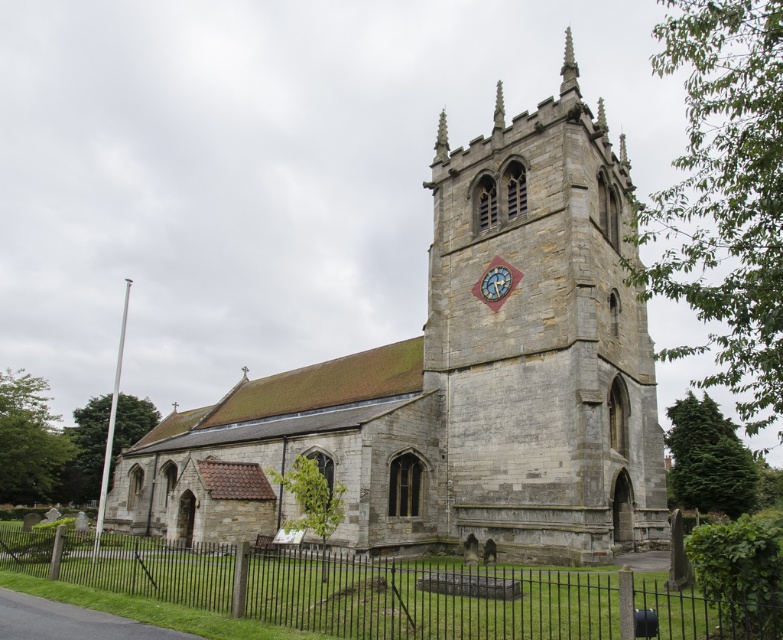
You are standing in front of a traditional stone church with a clock tower. You notice two structures at the upper center of the church building. One is labeled as the stone spire at upper center and the other as the stone steeple at upper center. According to their positions, which one is located to the right?

The stone spire at upper center is located to the right of the stone steeple at upper center.

You are standing at the entrance of the traditional stone church and looking towards the clock tower. There is a stone spire located at point (568, 67). Can you tell me the direction of the stone spire relative to your position?

The stone spire at upper center is located at point (568, 67), which is in the upper center direction from your position at the entrance.

You are a drone operator tasked with capturing aerial footage of the church. Your drone has a maximum flight range of 50 meters from its starting position. If you position yourself at the black wrought iron fence at lower center, will you be able to film the stone steeple at upper center without exceeding the drone range limit?

The black wrought iron fence at lower center and the stone steeple at upper center are 46.11 meters apart. Since the drone can fly up to 50 meters, it can reach the stone steeple at upper center from the black wrought iron fence at lower center without exceeding the range limit.